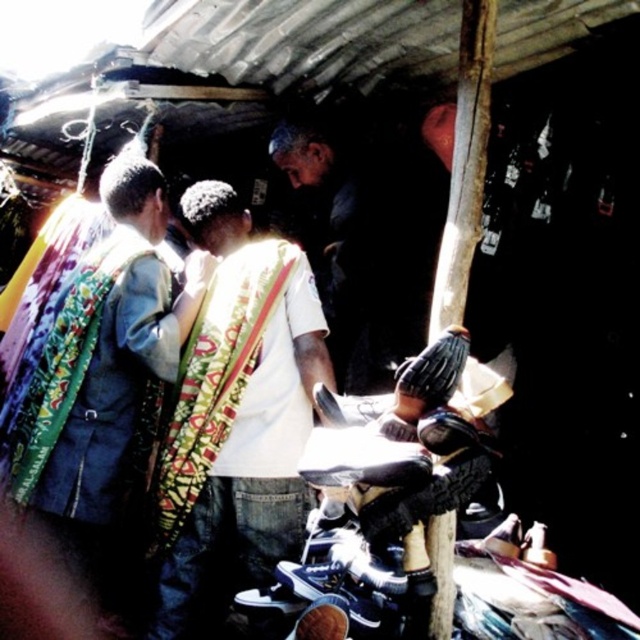
Question: Which point is farther from the camera taking this photo?

Choices:
 (A) (280, 372)
 (B) (52, 438)

Answer: (B)

Question: Does white cotton shirt at center lie in front of printed fabric vest at center?

Choices:
 (A) no
 (B) yes

Answer: (B)

Question: Is white cotton shirt at center above printed fabric vest at center?

Choices:
 (A) yes
 (B) no

Answer: (B)

Question: Does white cotton shirt at center come behind printed fabric vest at center?

Choices:
 (A) no
 (B) yes

Answer: (A)